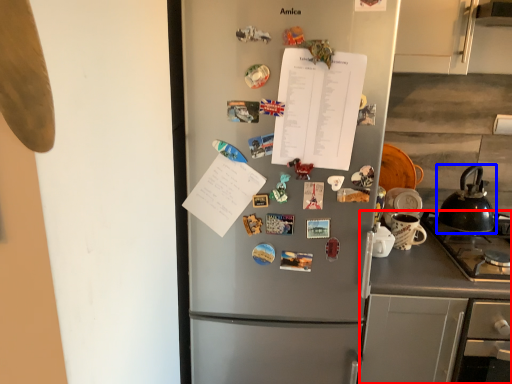
Question: Among these objects, which one is farthest to the camera, counter (highlighted by a red box) or kettle (highlighted by a blue box)?

Choices:
 (A) counter
 (B) kettle

Answer: (B)